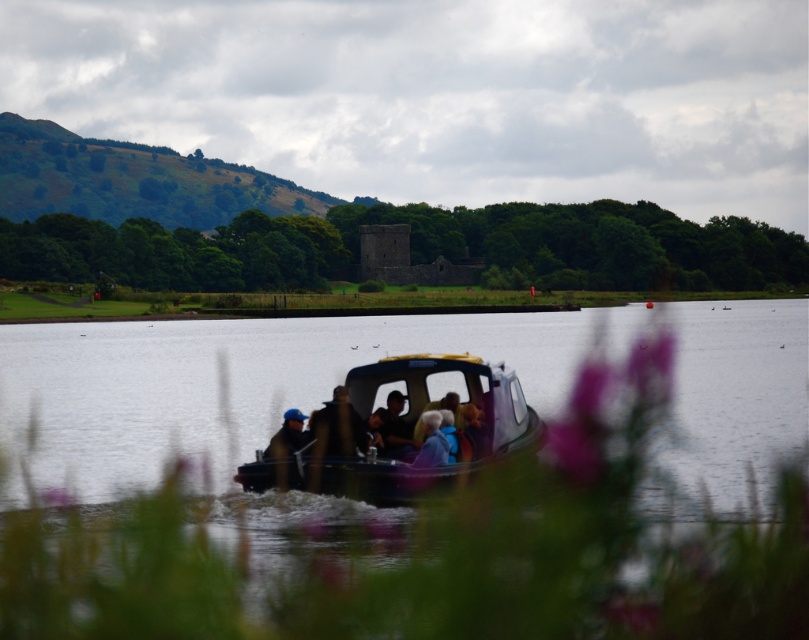
Question: Which object is positioned farthest from the dark brown leather jacket at center?

Choices:
 (A) clear water at center
 (B) blue fabric jacket at center
 (C) matte blue boat at center

Answer: (A)

Question: Among these points, which one is farthest from the camera?

Choices:
 (A) (799, 417)
 (B) (477, 406)
 (C) (329, 401)
 (D) (378, 408)

Answer: (A)

Question: Does clear water at center appear on the left side of matte blue boat at center?

Choices:
 (A) yes
 (B) no

Answer: (B)

Question: Can you confirm if clear water at center is positioned to the left of dark brown leather jacket at center?

Choices:
 (A) yes
 (B) no

Answer: (B)

Question: Which of the following is the farthest from the observer?

Choices:
 (A) (431, 452)
 (B) (316, 410)
 (C) (380, 424)
 (D) (414, 417)

Answer: (D)

Question: Is light blue fabric jacket at center smaller than blue fabric jacket at center?

Choices:
 (A) no
 (B) yes

Answer: (B)